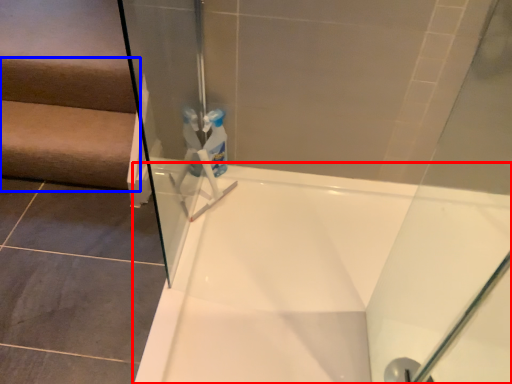
Question: Among these objects, which one is nearest to the camera, bathtub (highlighted by a red box) or stairwell (highlighted by a blue box)?

Choices:
 (A) bathtub
 (B) stairwell

Answer: (A)